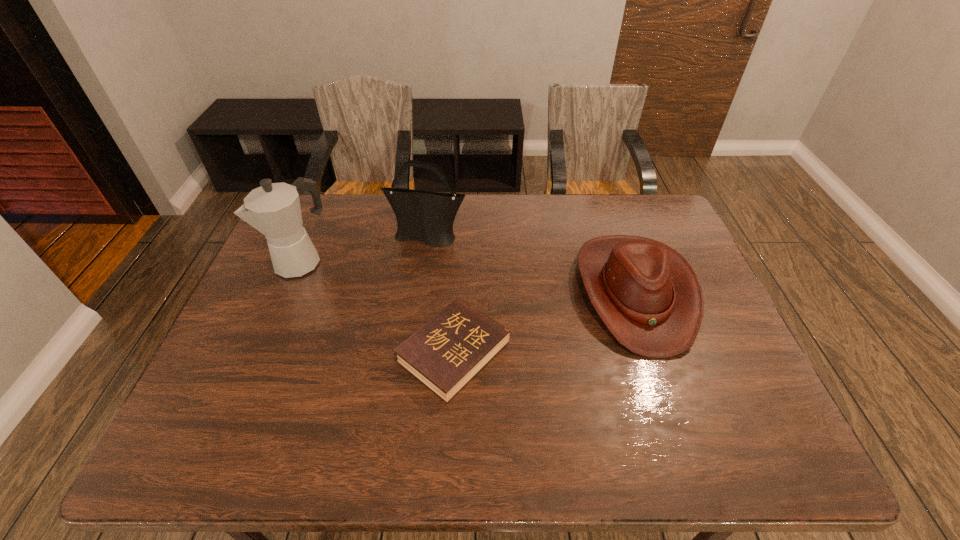
Where is `object present at the left edge`? object present at the left edge is located at coordinates (273, 209).

Identify the location of object that is at the right edge. Image resolution: width=960 pixels, height=540 pixels. (648, 296).

In the image, there is a desktop. At what (x,y) coordinates should I click in order to perform the action: click on free space at the far edge. Please return your answer as a coordinate pair (x, y). Looking at the image, I should click on (365, 227).

The image size is (960, 540). What are the coordinates of `vacant space at the near edge` in the screenshot? It's located at (456, 457).

Identify the location of vacant space at the left edge of the desktop. (283, 280).

Find the location of a particular element. free location at the right edge of the desktop is located at coordinates (684, 249).

Where is `vacant region at the near right corner of the desktop`? vacant region at the near right corner of the desktop is located at coordinates (710, 449).

Identify the location of unoccupied position between the hardback book and the leftmost object. This screenshot has width=960, height=540. (378, 307).

This screenshot has width=960, height=540. I want to click on free space between the shortest object and the shoulder bag, so click(x=441, y=295).

Locate an element on the screen. The width and height of the screenshot is (960, 540). free space between the second shortest object and the hardback book is located at coordinates (544, 322).